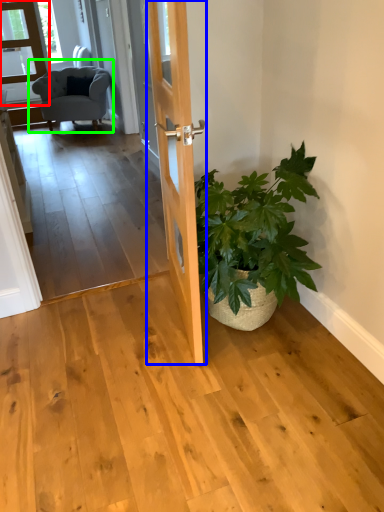
Question: Which object is the closest to the glass door (highlighted by a red box)? Choose among these: door (highlighted by a blue box) or chair (highlighted by a green box).

Choices:
 (A) door
 (B) chair

Answer: (B)